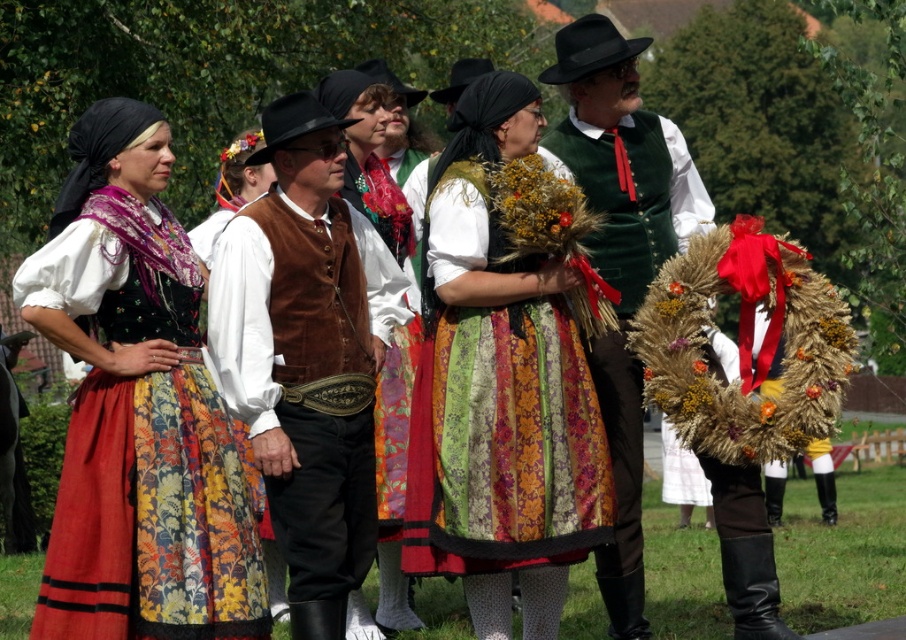
Question: Does matte floral skirt at center have a larger size compared to green velvet vest at center?

Choices:
 (A) yes
 (B) no

Answer: (B)

Question: Can you confirm if multicolored fabric dress at center is thinner than brown suede vest at center?

Choices:
 (A) yes
 (B) no

Answer: (B)

Question: Among these points, which one is farthest from the camera?

Choices:
 (A) (258, 337)
 (B) (723, 488)

Answer: (B)

Question: Is matte floral skirt at center smaller than multicolored fabric dress at center?

Choices:
 (A) yes
 (B) no

Answer: (A)

Question: Which is nearer to the green velvet vest at center?

Choices:
 (A) multicolored fabric dress at center
 (B) matte floral skirt at center

Answer: (A)

Question: Which point is farther to the camera?

Choices:
 (A) (294, 515)
 (B) (583, 282)

Answer: (B)